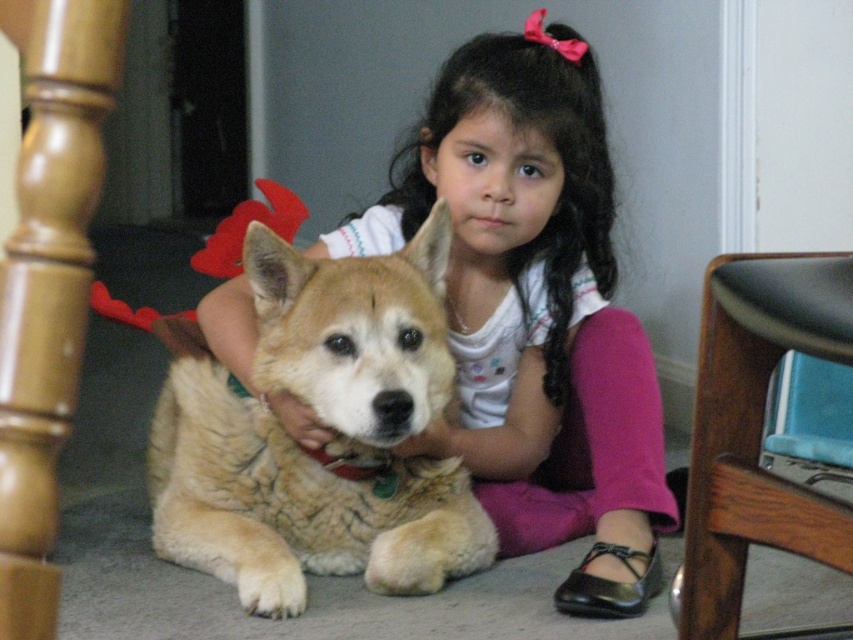
You are a photographer trying to capture a closeup of the golden fur dog at center. The camera you have can only focus on objects within a 0.3 unit radius from the point specified by the coordinate point. Is the point at (294, 504) within the golden fur dog at center?

The point at (294, 504) is on the golden fur dog at center, so yes, the camera can focus on the golden fur dog at center as the point is within its area.

You are a delivery robot with a package for the girl. The robot has a height of 1.5 meters. The package is placed on the floor at point (479,348). Can you reach the package without bending down?

The package is placed on the floor at point (479,348). Since the robot is 1.5 meters tall, it can easily reach the package without bending down as the package is on the floor and the robot can access it from its current height.

You are a photographer trying to capture a candid shot of the golden fur dog at center and the smooth white shirt at center. Since you want both subjects in the frame, which direction should you move your camera to ensure both are visible?

Since the smooth white shirt at center is to the right of the golden fur dog at center, you should move your camera slightly to the left to ensure both subjects are visible in the frame.